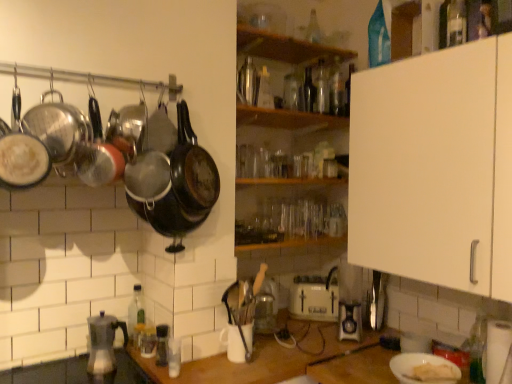
Question: Can you confirm if matte black frying pan at left is taller than translucent glass jar at lower center, acting as the 5th appliance starting from the right?

Choices:
 (A) no
 (B) yes

Answer: (B)

Question: Is matte black frying pan at left not near translucent glass jar at lower center, acting as the second appliance starting from the left?

Choices:
 (A) yes
 (B) no

Answer: (B)

Question: Considering the relative positions of matte black frying pan at left and translucent glass jar at lower center, acting as the 5th appliance starting from the right, in the image provided, is matte black frying pan at left to the left of translucent glass jar at lower center, acting as the 5th appliance starting from the right, from the viewer's perspective?

Choices:
 (A) yes
 (B) no

Answer: (A)

Question: Is matte black frying pan at left positioned behind translucent glass jar at lower center, which ranks as the third appliance in back-to-front order?

Choices:
 (A) yes
 (B) no

Answer: (B)

Question: From a real-world perspective, is matte black frying pan at left physically above translucent glass jar at lower center, acting as the second appliance starting from the left?

Choices:
 (A) no
 (B) yes

Answer: (B)

Question: From the image's perspective, is matte black frying pan at left above translucent glass jar at lower center, acting as the 5th appliance starting from the right?

Choices:
 (A) no
 (B) yes

Answer: (B)

Question: From a real-world perspective, is transparent glass bottle at upper center, which is counted as the 6th bottle, starting from the left, located beneath matte black frying pan at left?

Choices:
 (A) no
 (B) yes

Answer: (A)

Question: Is transparent glass bottle at upper center, marked as the ninth bottle in a front-to-back arrangement, located outside matte black frying pan at left?

Choices:
 (A) yes
 (B) no

Answer: (A)

Question: Does transparent glass bottle at upper center, which appears as the first bottle when viewed from the back, have a lesser height compared to matte black frying pan at left?

Choices:
 (A) no
 (B) yes

Answer: (B)

Question: Can you confirm if transparent glass bottle at upper center, the fourth bottle viewed from the right, is thinner than matte black frying pan at left?

Choices:
 (A) no
 (B) yes

Answer: (B)

Question: From the image's perspective, would you say transparent glass bottle at upper center, which is counted as the 6th bottle, starting from the left, is shown under matte black frying pan at left?

Choices:
 (A) yes
 (B) no

Answer: (B)

Question: Is wooden shelf at center, the 2th shelf viewed from the top, shorter than white matte counter top at center?

Choices:
 (A) no
 (B) yes

Answer: (B)